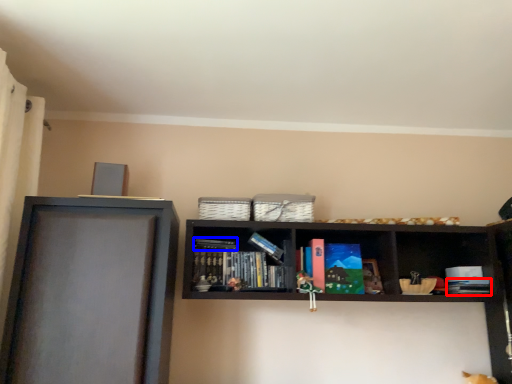
Question: Among these objects, which one is farthest to the camera, book (highlighted by a red box) or book (highlighted by a blue box)?

Choices:
 (A) book
 (B) book

Answer: (B)